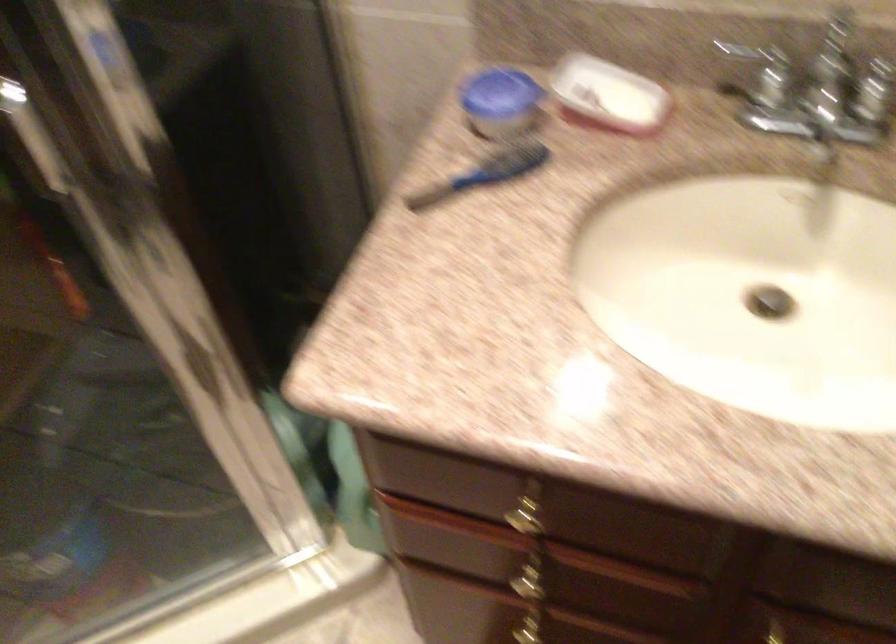
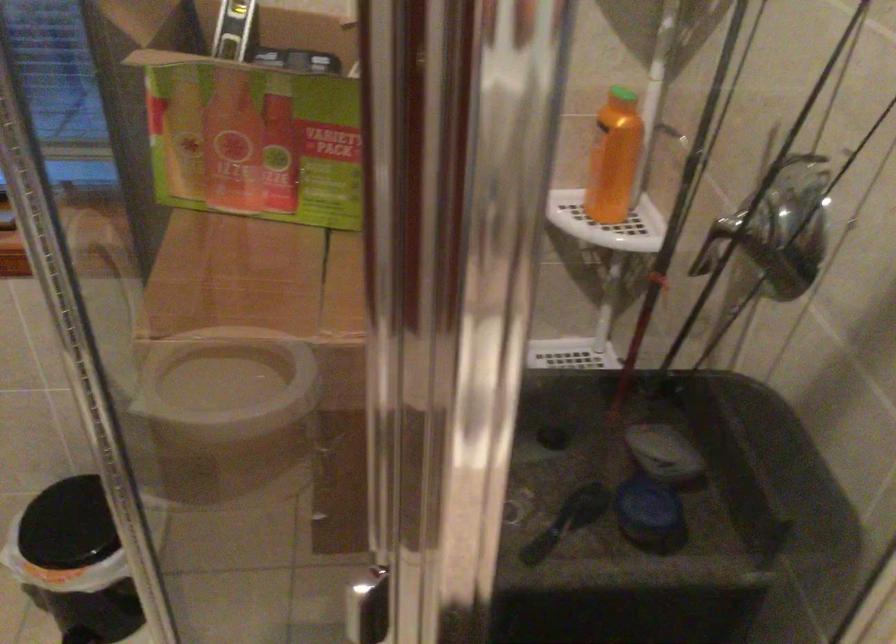
Question: The camera is either moving clockwise (left) or counter-clockwise (right) around the object. The first image is from the beginning of the video and the second image is from the end. Is the camera moving left or right when shooting the video?

Choices:
 (A) Left
 (B) Right

Answer: (B)